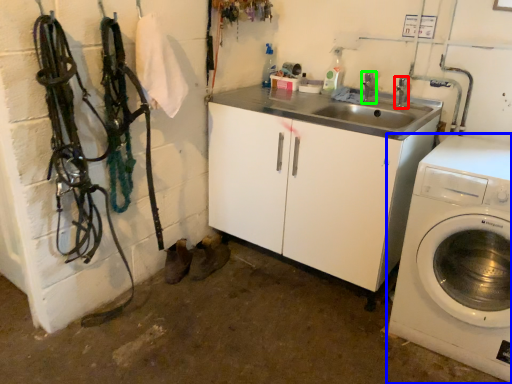
Question: Estimate the real-world distances between objects in this image. Which object is farther from faucet (highlighted by a red box), washing machine (highlighted by a blue box) or faucet (highlighted by a green box)?

Choices:
 (A) washing machine
 (B) faucet

Answer: (A)